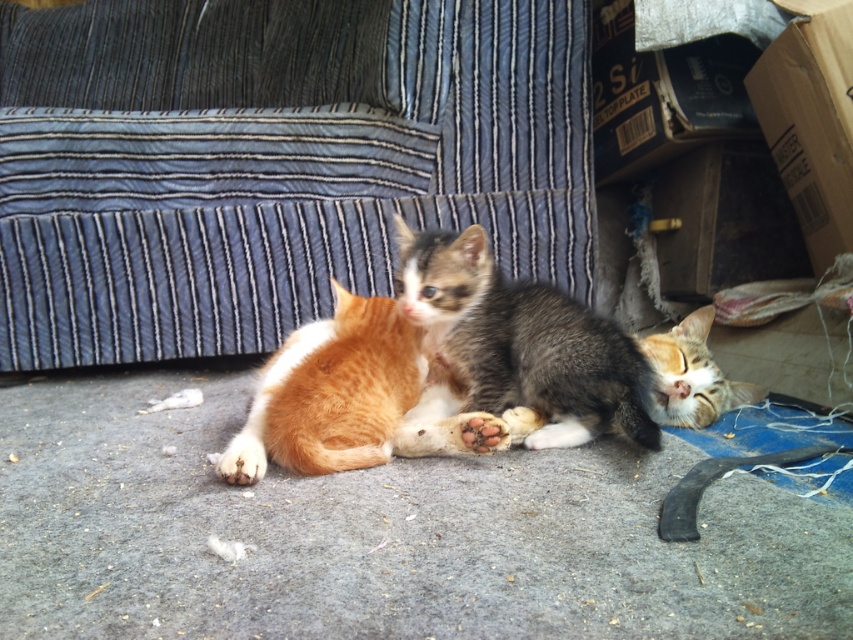
You are a cat owner who wants to place a small cat tree in your living room. The blue striped fabric couch at upper center is located at point [271,161]. If you want to place the cat tree 0.1 units to the right of the couch, what coordinate should you use?

The cat tree should be placed at coordinate point 0.353, 0.320 since adding 0.1 to the x coordinate of the blue striped fabric couch at upper center at point [271,161] gives 0.353, 0.320.